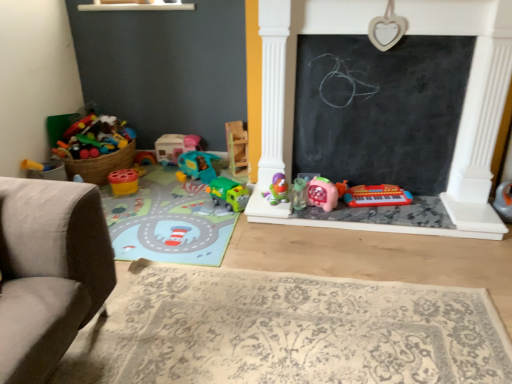
Find the location of a particular element. vacant space situated above black chalkboard at center (from a real-world perspective) is located at coordinates (387, 36).